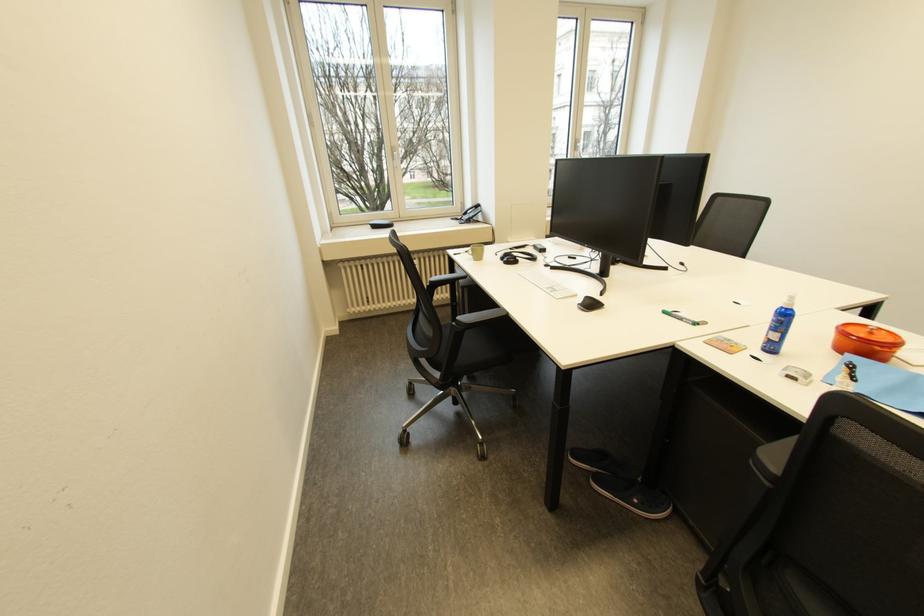
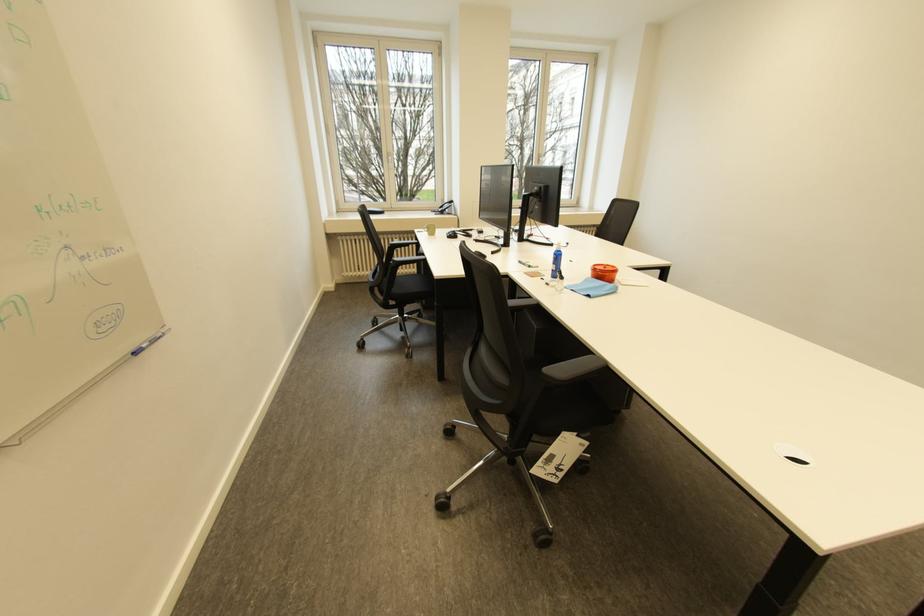
Find the pixel in the second image that matches point (585, 140) in the first image.

(548, 156)